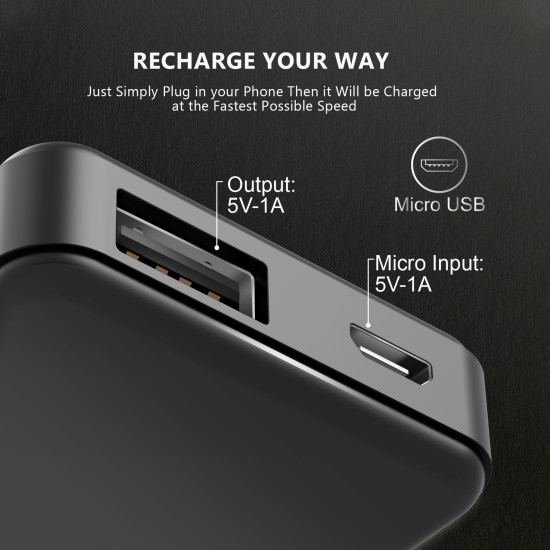
At what (x,y) coordinates should I click in order to perform the action: click on plug. Please return your answer as a coordinate pair (x, y). This screenshot has height=550, width=550. Looking at the image, I should click on (390, 358), (200, 283).